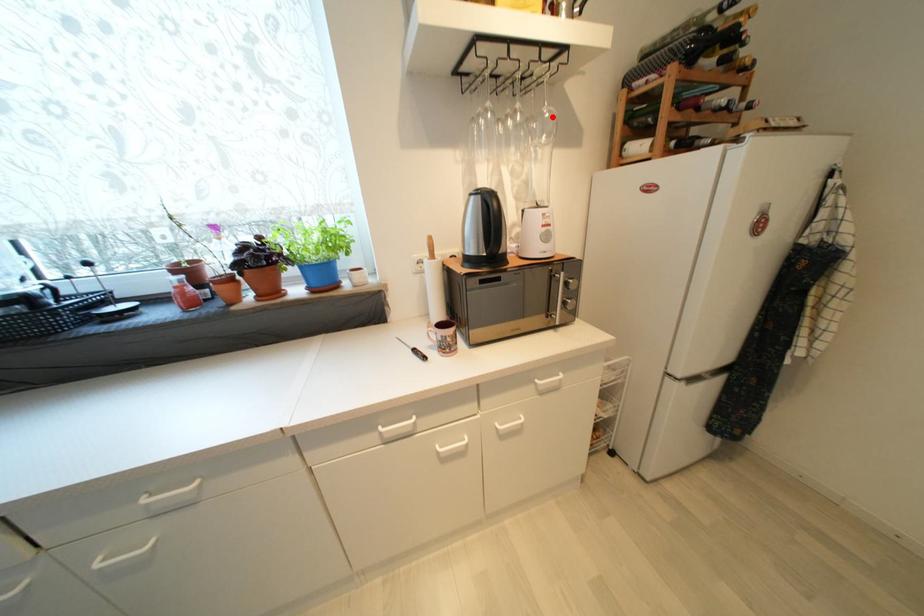
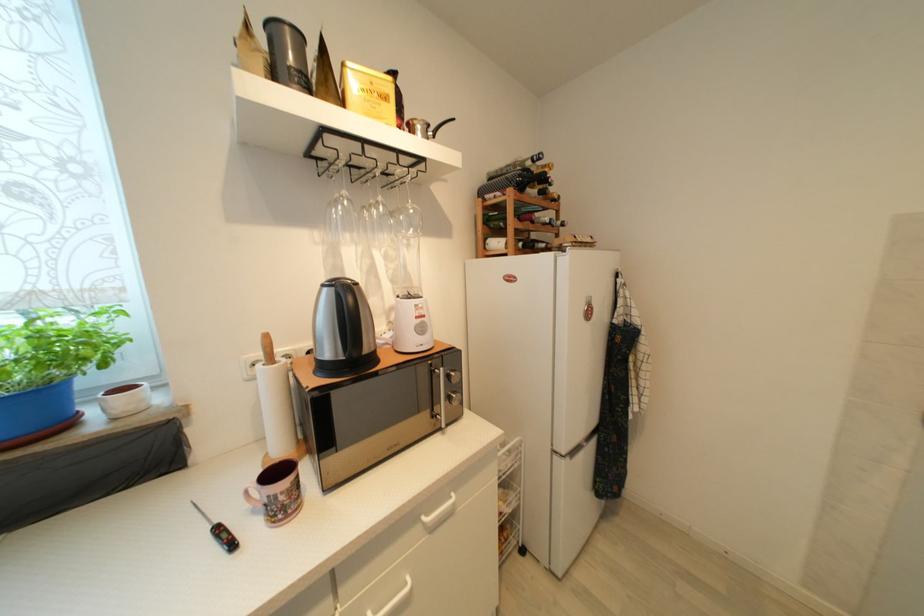
Find the pixel in the second image that matches the highlighted location in the first image.

(417, 213)